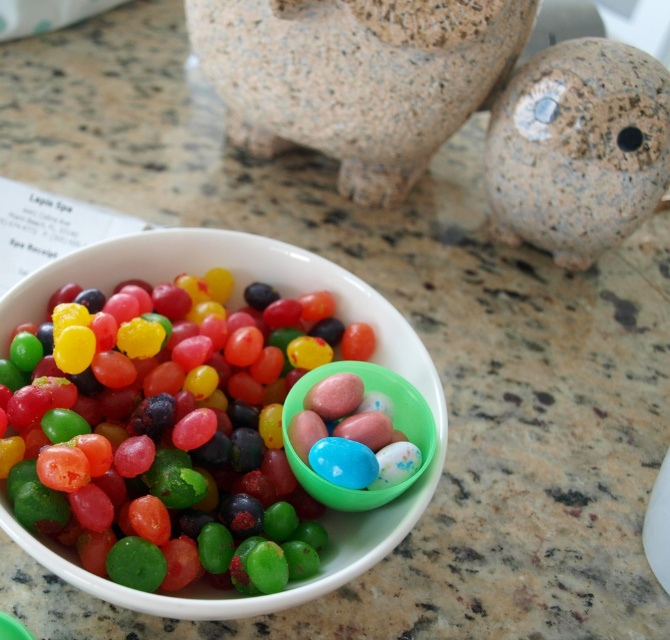
You are a child who wants to place the granite piggy bank at upper center on top of the speckled stone ball at upper right. Based on their sizes, do you think this will be possible?

The granite piggy bank at upper center is not as tall as the speckled stone ball at upper right, so it might be possible to place the piggy bank on top of the ball since the ball is taller and could provide a stable base.

You are standing in front of a bowl of jelly beans on a countertop. There are two points marked in the image. One is at coordinates point (395, 102) and the other at point (302, 445). Which point is closer to you?

Point (395, 102) is closer to you because it is further to the viewer than point (302, 445).

You are a child who wants to stack the translucent plastic eggs at center on top of the granite piggy bank at upper center. Will the eggs fit on top of the piggy bank?

The granite piggy bank at upper center is taller than the translucent plastic eggs at center, so the eggs will fit on top of the piggy bank since the piggy bank is taller and provides a stable base.